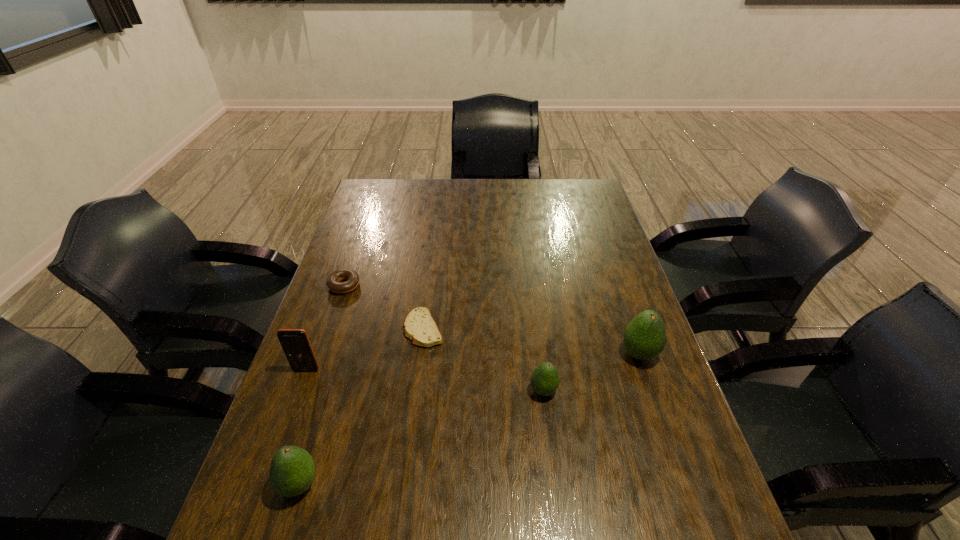
Find the location of a particular element. This screenshot has width=960, height=540. the leftmost avocado is located at coordinates (292, 470).

Find the location of `the nearest avocado`. the nearest avocado is located at coordinates (292, 470).

You are a GUI agent. You are given a task and a screenshot of the screen. Output one action in this format:
    pyautogui.click(x=<x>, y=<y>)
    Task: Click on the second nearest object
    The width and height of the screenshot is (960, 540).
    Given the screenshot: What is the action you would take?
    pyautogui.click(x=544, y=380)

At what (x,y) coordinates should I click in order to perform the action: click on the fifth object from left to right. Please return your answer as a coordinate pair (x, y). This screenshot has height=540, width=960. Looking at the image, I should click on click(x=544, y=380).

Where is `the rightmost avocado`? the rightmost avocado is located at coordinates (645, 337).

At what (x,y) coordinates should I click in order to perform the action: click on the farthest avocado. Please return your answer as a coordinate pair (x, y). Image resolution: width=960 pixels, height=540 pixels. Looking at the image, I should click on (645, 337).

Where is `cellular telephone`? This screenshot has width=960, height=540. cellular telephone is located at coordinates (295, 342).

Where is `the shortest object`? This screenshot has width=960, height=540. the shortest object is located at coordinates (419, 326).

Locate an element on the screen. the fourth object from left to right is located at coordinates (419, 326).

Image resolution: width=960 pixels, height=540 pixels. What are the coordinates of `the farthest object` in the screenshot? It's located at (333, 282).